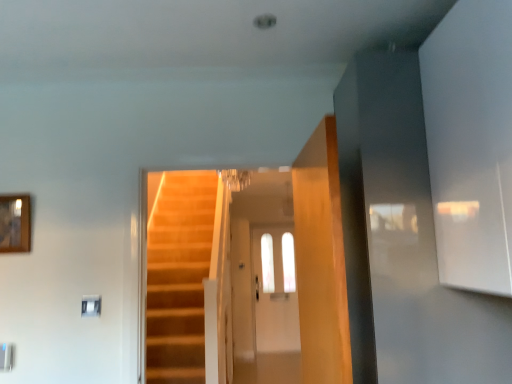
In order to face wooden framed mirror at upper left, should I rotate leftwards or rightwards?

Turn left approximately 30.537 degrees to face it.

What is the approximate height of wooden framed mirror at upper left?

It is 11.52 inches.

At what (x,y) coordinates should I click in order to perform the action: click on wooden framed mirror at upper left. Please return your answer as a coordinate pair (x, y). Looking at the image, I should click on (15, 223).

The height and width of the screenshot is (384, 512). What do you see at coordinates (15, 223) in the screenshot?
I see `wooden framed mirror at upper left` at bounding box center [15, 223].

Image resolution: width=512 pixels, height=384 pixels. I want to click on clear glass door at center, so click(275, 316).

Measure the distance between clear glass door at center and camera.

clear glass door at center and camera are 3.97 meters apart.

The width and height of the screenshot is (512, 384). What do you see at coordinates (275, 316) in the screenshot?
I see `clear glass door at center` at bounding box center [275, 316].

Locate an element on the screen. This screenshot has width=512, height=384. wooden framed mirror at upper left is located at coordinates (15, 223).

Which object is positioned more to the left, wooden framed mirror at upper left or clear glass door at center?

wooden framed mirror at upper left.

Relative to clear glass door at center, is wooden framed mirror at upper left in front or behind?

wooden framed mirror at upper left is in front of clear glass door at center.

Is point (7, 202) closer to viewer compared to point (290, 293)?

Yes, it is in front of point (290, 293).

From the image's perspective, between wooden framed mirror at upper left and clear glass door at center, which one is located above?

wooden framed mirror at upper left.

Looking at this image, from a real-world perspective, is wooden framed mirror at upper left above or below clear glass door at center?

Clearly, from a real-world perspective, wooden framed mirror at upper left is above clear glass door at center.

Looking at their sizes, would you say wooden framed mirror at upper left is wider or thinner than clear glass door at center?

In the image, wooden framed mirror at upper left appears to be more narrow than clear glass door at center.

Can you confirm if wooden framed mirror at upper left is taller than clear glass door at center?

No.

Considering the sizes of wooden framed mirror at upper left and clear glass door at center in the image, is wooden framed mirror at upper left bigger or smaller than clear glass door at center?

Clearly, wooden framed mirror at upper left is smaller in size than clear glass door at center.

Can we say wooden framed mirror at upper left lies outside clear glass door at center?

That's correct, wooden framed mirror at upper left is outside of clear glass door at center.

Would you consider wooden framed mirror at upper left to be distant from clear glass door at center?

Indeed, wooden framed mirror at upper left is not near clear glass door at center.

Is wooden framed mirror at upper left positioned with its back to clear glass door at center?

That's right, wooden framed mirror at upper left is facing away from clear glass door at center.

Can you tell me how much wooden framed mirror at upper left and clear glass door at center differ in facing direction?

1.27 degrees.

In the image, there is a wooden framed mirror at upper left. What are the coordinates of `glass door below it (from a real-world perspective)` in the screenshot? It's located at (275, 316).

Which object is positioned more to the left, clear glass door at center or wooden framed mirror at upper left?

wooden framed mirror at upper left.

Does clear glass door at center lie in front of wooden framed mirror at upper left?

That is False.

Which is behind, point (259, 336) or point (12, 226)?

The point (259, 336) is more distant.

From the image's perspective, is clear glass door at center beneath wooden framed mirror at upper left?

Indeed, from the image's perspective, clear glass door at center is shown beneath wooden framed mirror at upper left.

From the picture: From a real-world perspective, between clear glass door at center and wooden framed mirror at upper left, who is vertically lower?

clear glass door at center.

Between clear glass door at center and wooden framed mirror at upper left, which one has smaller width?

With smaller width is wooden framed mirror at upper left.

Who is shorter, clear glass door at center or wooden framed mirror at upper left?

wooden framed mirror at upper left is shorter.

Consider the image. Is clear glass door at center bigger or smaller than wooden framed mirror at upper left?

Clearly, clear glass door at center is larger in size than wooden framed mirror at upper left.

Which is correct: clear glass door at center is inside wooden framed mirror at upper left, or outside of it?

clear glass door at center is not inside wooden framed mirror at upper left, it's outside.

Is there a large distance between clear glass door at center and wooden framed mirror at upper left?

clear glass door at center is far away from wooden framed mirror at upper left.

Is clear glass door at center positioned with its back to wooden framed mirror at upper left?

clear glass door at center is not turned away from wooden framed mirror at upper left.

What's the angular difference between clear glass door at center and wooden framed mirror at upper left's facing directions?

The angular difference between clear glass door at center and wooden framed mirror at upper left is 1.27 degrees.

Identify the location of glass door behind the wooden framed mirror at upper left. (275, 316).

The height and width of the screenshot is (384, 512). In the image, there is a clear glass door at center. What are the coordinates of `picture frame above it (from the image's perspective)` in the screenshot? It's located at (15, 223).

At what (x,y) coordinates should I click in order to perform the action: click on glass door located on the right of wooden framed mirror at upper left. Please return your answer as a coordinate pair (x, y). The image size is (512, 384). Looking at the image, I should click on [x=275, y=316].